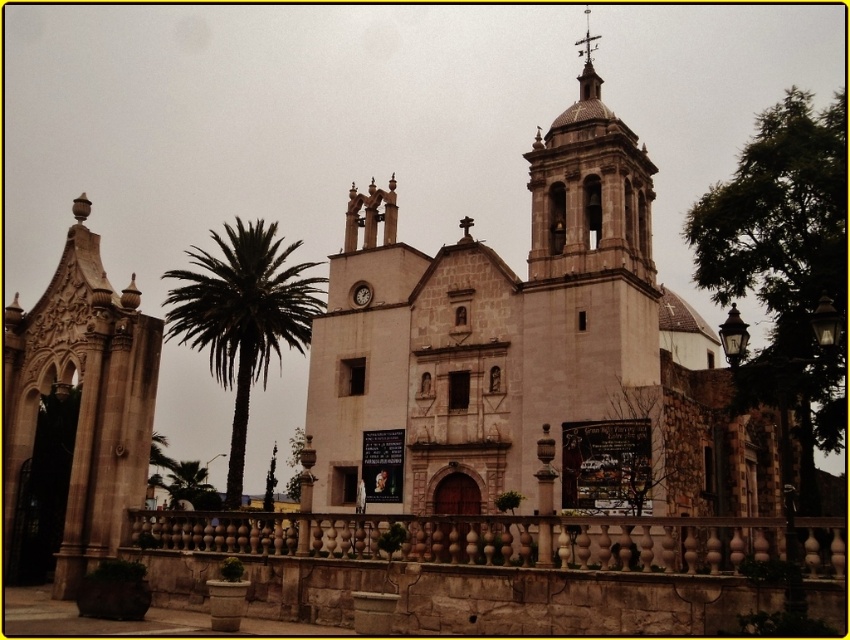
Does beige stone church at center have a smaller size compared to polished copper spire at upper center?

Actually, beige stone church at center might be larger than polished copper spire at upper center.

Does beige stone church at center have a greater height compared to polished copper spire at upper center?

Yes.

Which is behind, point (672, 426) or point (585, 26)?

The point (585, 26) is more distant.

This screenshot has width=850, height=640. I want to click on beige stone church at center, so click(524, 355).

Does beige stone church at center have a smaller size compared to brown stone fence at lower center?

No.

Which is below, beige stone church at center or brown stone fence at lower center?

brown stone fence at lower center is below.

Which is behind, point (406, 280) or point (522, 609)?

The point (406, 280) is behind.

Image resolution: width=850 pixels, height=640 pixels. Find the location of `beige stone church at center`. beige stone church at center is located at coordinates (524, 355).

Is brown stone fence at lower center to the left of green leafy palm tree at center from the viewer's perspective?

In fact, brown stone fence at lower center is to the right of green leafy palm tree at center.

Who is shorter, brown stone fence at lower center or green leafy palm tree at center?

brown stone fence at lower center

Which is behind, point (428, 620) or point (269, 486)?

The point (269, 486) is behind.

Image resolution: width=850 pixels, height=640 pixels. Find the location of `brown stone fence at lower center`. brown stone fence at lower center is located at coordinates coord(474,568).